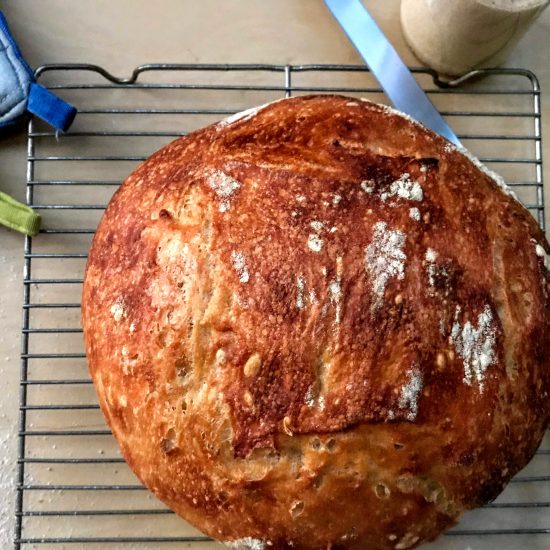
Find the location of `potholder`. potholder is located at coordinates (19, 97).